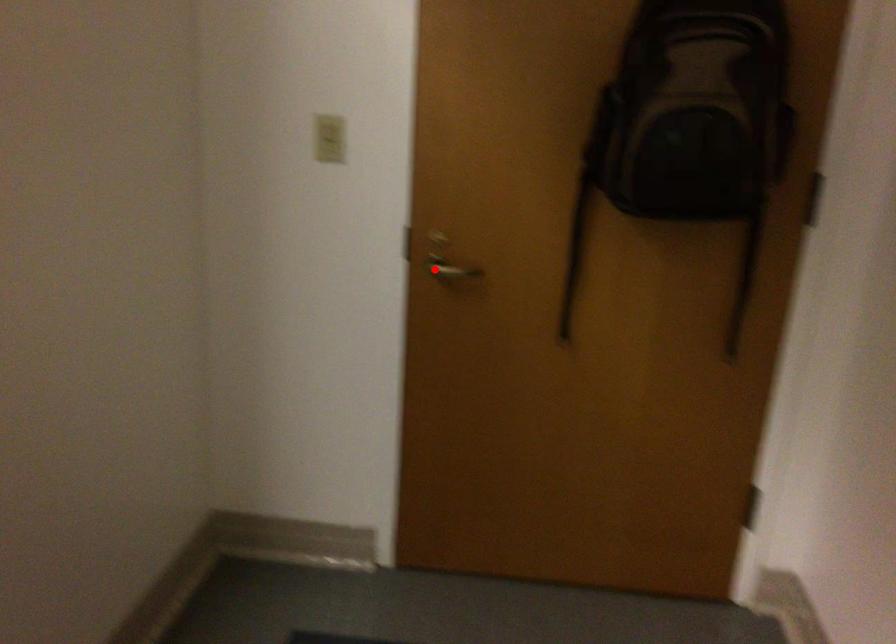
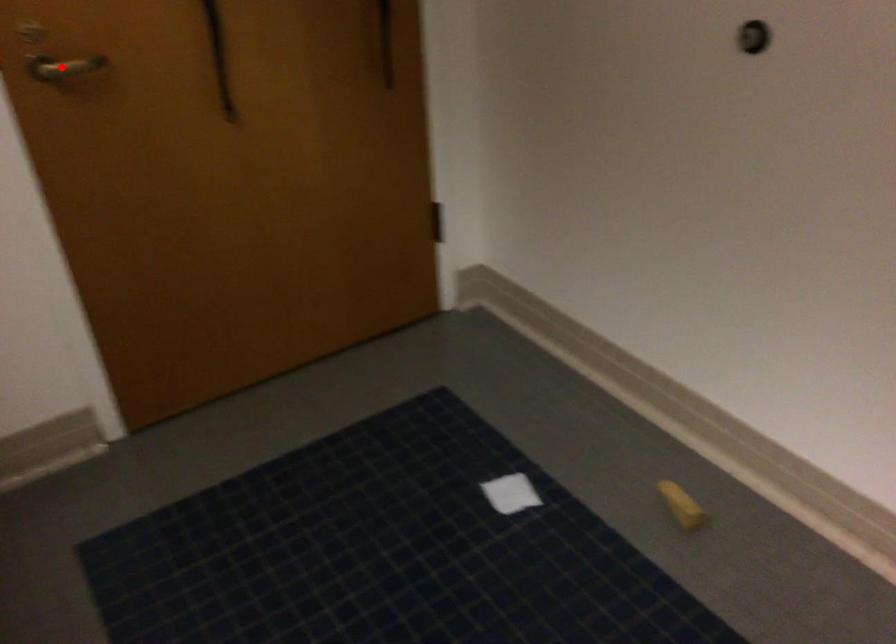
I am providing you with two images of the same scene from different viewpoints. A red point is marked on the first image and another point is marked on the second image. Is the marked point in image1 the same physical position as the marked point in image2?

Yes